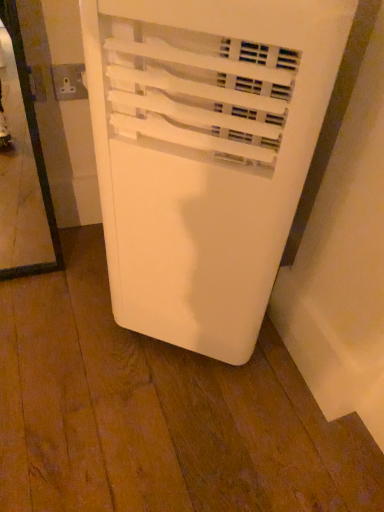
Question: Does white plastic socket at upper left lie in front of white plastic air conditioner at center?

Choices:
 (A) no
 (B) yes

Answer: (A)

Question: From the image's perspective, is white plastic socket at upper left below white plastic air conditioner at center?

Choices:
 (A) no
 (B) yes

Answer: (A)

Question: Does white plastic socket at upper left have a larger size compared to white plastic air conditioner at center?

Choices:
 (A) no
 (B) yes

Answer: (A)

Question: Considering the relative sizes of white plastic socket at upper left and white plastic air conditioner at center in the image provided, is white plastic socket at upper left thinner than white plastic air conditioner at center?

Choices:
 (A) yes
 (B) no

Answer: (A)

Question: Is white plastic air conditioner at center at the back of white plastic socket at upper left?

Choices:
 (A) no
 (B) yes

Answer: (A)

Question: Is white plastic socket at upper left taller than white plastic air conditioner at center?

Choices:
 (A) no
 (B) yes

Answer: (A)

Question: Does white plastic air conditioner at center contain white plastic socket at upper left?

Choices:
 (A) yes
 (B) no

Answer: (B)

Question: Considering the relative sizes of white plastic air conditioner at center and white plastic socket at upper left in the image provided, is white plastic air conditioner at center taller than white plastic socket at upper left?

Choices:
 (A) no
 (B) yes

Answer: (B)

Question: Can you confirm if white plastic air conditioner at center is shorter than white plastic socket at upper left?

Choices:
 (A) yes
 (B) no

Answer: (B)

Question: Is white plastic air conditioner at center to the right of white plastic socket at upper left from the viewer's perspective?

Choices:
 (A) yes
 (B) no

Answer: (A)

Question: Considering the relative positions of white plastic air conditioner at center and white plastic socket at upper left in the image provided, is white plastic air conditioner at center to the left of white plastic socket at upper left from the viewer's perspective?

Choices:
 (A) no
 (B) yes

Answer: (A)

Question: Is white plastic air conditioner at center closer to the viewer compared to white plastic socket at upper left?

Choices:
 (A) no
 (B) yes

Answer: (B)

Question: Is point (67, 93) positioned closer to the camera than point (228, 334)?

Choices:
 (A) farther
 (B) closer

Answer: (A)